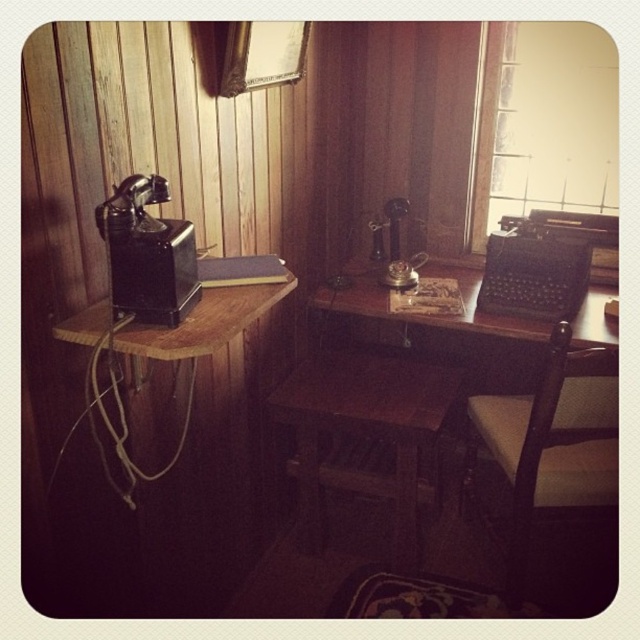
From the picture: You are organizing a small event in the study and need to place a decorative vase between the wooden stool at center and the light brown wooden chair at lower right. Based on their positions, where should you place the vase to ensure it is between them?

The wooden stool at center is positioned on the left side of light brown wooden chair at lower right, so placing the vase between them would require positioning it to the right of the wooden stool at center and to the left of the light brown wooden chair at lower right.

You are a delivery person trying to place a large package between the wooden stool at center and the light brown wooden chair at lower right. Can you fit the package there if it requires at least 1 meter of space?

The wooden stool at center might be wider than light brown wooden chair at lower right, so the available space between them is uncertain. Without knowing the exact width difference, it is impossible to determine if the package will fit.